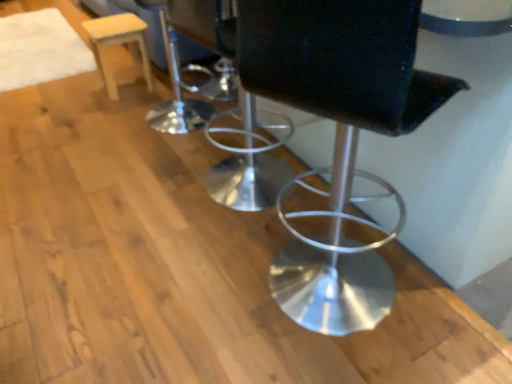
Question: Is light wood stool at upper left bigger than metallic silver stool at center?

Choices:
 (A) no
 (B) yes

Answer: (A)

Question: Is light wood stool at upper left next to metallic silver stool at center and touching it?

Choices:
 (A) yes
 (B) no

Answer: (B)

Question: Is light wood stool at upper left smaller than metallic silver stool at center?

Choices:
 (A) yes
 (B) no

Answer: (A)

Question: Is light wood stool at upper left to the right of metallic silver stool at center from the viewer's perspective?

Choices:
 (A) no
 (B) yes

Answer: (A)

Question: Considering the relative sizes of light wood stool at upper left and metallic silver stool at center in the image provided, is light wood stool at upper left thinner than metallic silver stool at center?

Choices:
 (A) no
 (B) yes

Answer: (B)

Question: From the image's perspective, is light wood stool at upper left located above metallic silver stool at center?

Choices:
 (A) no
 (B) yes

Answer: (B)

Question: Is metallic silver stool at center further to camera compared to light wood stool at upper left?

Choices:
 (A) yes
 (B) no

Answer: (B)

Question: From the image's perspective, is metallic silver stool at center above light wood stool at upper left?

Choices:
 (A) no
 (B) yes

Answer: (A)

Question: Is metallic silver stool at center wider than light wood stool at upper left?

Choices:
 (A) no
 (B) yes

Answer: (B)

Question: Is metallic silver stool at center shorter than light wood stool at upper left?

Choices:
 (A) yes
 (B) no

Answer: (B)

Question: Is metallic silver stool at center in front of light wood stool at upper left?

Choices:
 (A) yes
 (B) no

Answer: (A)

Question: From a real-world perspective, is metallic silver stool at center located higher than light wood stool at upper left?

Choices:
 (A) no
 (B) yes

Answer: (B)

Question: From a real-world perspective, is metallic silver stool at center above or below light wood stool at upper left?

Choices:
 (A) above
 (B) below

Answer: (A)